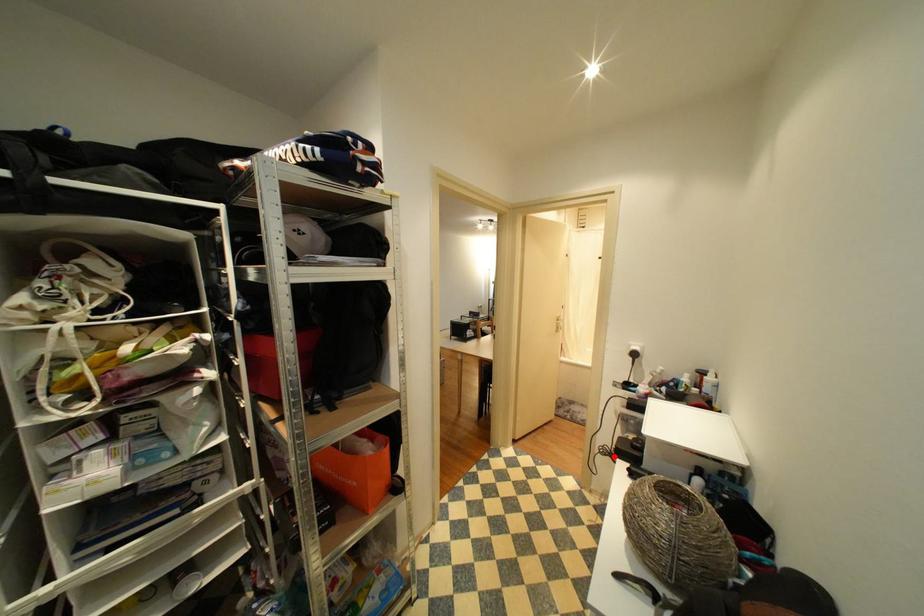
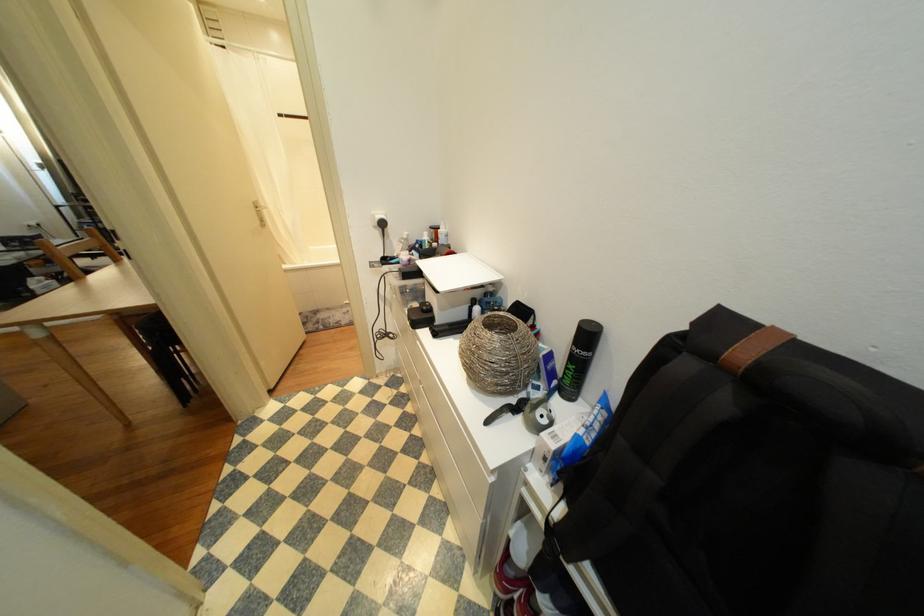
In the second image, find the point that corresponds to the highlighted location in the first image.

(392, 339)